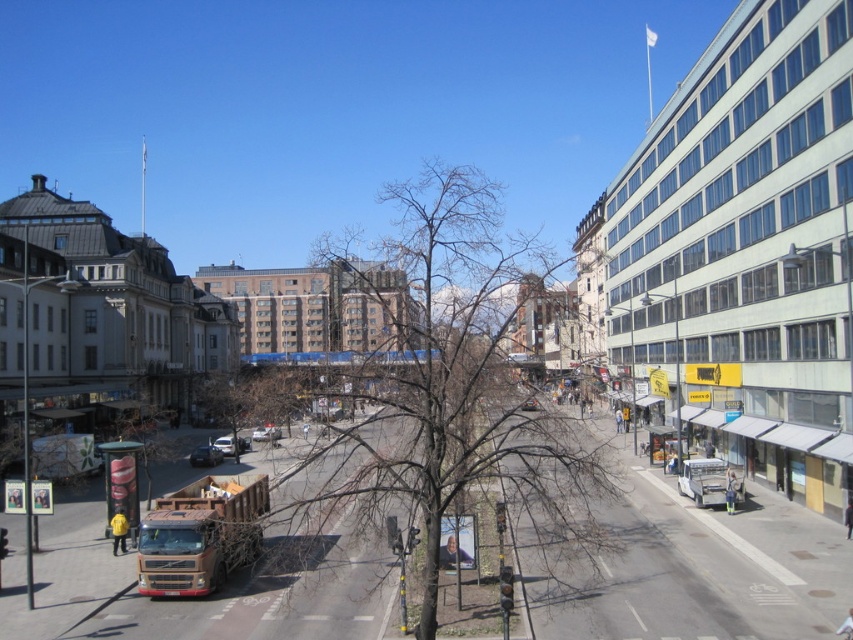
This screenshot has width=853, height=640. Describe the element at coordinates (456, 376) in the screenshot. I see `bare branches at center` at that location.

Can you confirm if bare branches at center is shorter than brown metallic truck at lower left?

Incorrect, bare branches at center's height does not fall short of brown metallic truck at lower left's.

Is point (399, 420) positioned behind point (216, 554)?

No, it is in front of (216, 554).

This screenshot has width=853, height=640. Find the location of `bare branches at center`. bare branches at center is located at coordinates (456, 376).

Measure the distance from metallic silver truck at center-left to metallic silver car at center.

9.46 meters

Is metallic silver truck at center-left behind metallic silver car at center?

No, metallic silver truck at center-left is in front of metallic silver car at center.

Who is more distant from viewer, (234, 436) or (253, 436)?

Point (253, 436)

Identify the location of metallic silver truck at center-left. The width and height of the screenshot is (853, 640). (231, 444).

Does metallic silver car at lower left appear on the right side of metallic silver truck at center-left?

Correct, you'll find metallic silver car at lower left to the right of metallic silver truck at center-left.

Identify the location of metallic silver car at lower left. The height and width of the screenshot is (640, 853). (206, 456).